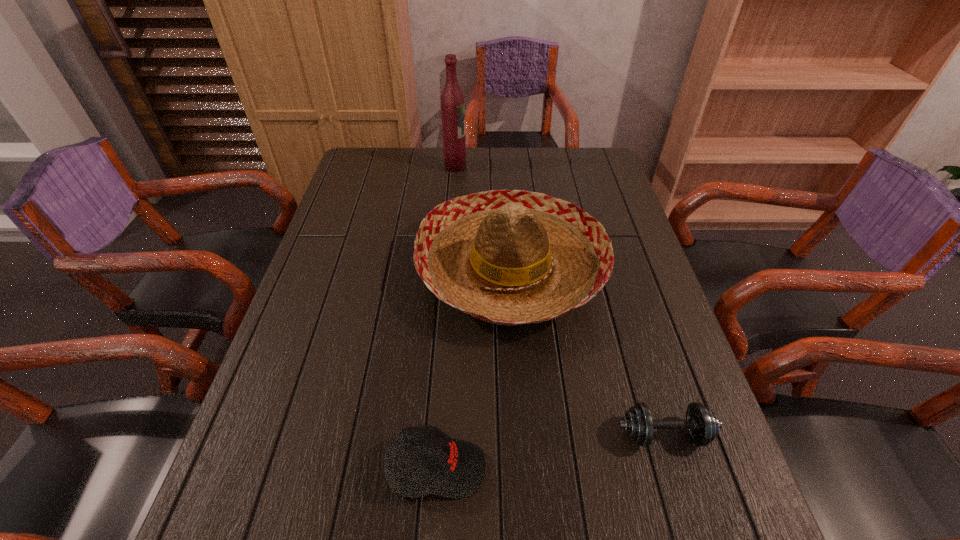
Identify the location of liquor. (452, 99).

Find the location of a particular element. The height and width of the screenshot is (540, 960). the tallest object is located at coordinates click(x=452, y=99).

Where is `the third nearest object`? the third nearest object is located at coordinates (510, 257).

You are a GUI agent. You are given a task and a screenshot of the screen. Output one action in this format:
    pyautogui.click(x=<x>, y=<y>)
    Task: Click on the sombrero
    The image size is (960, 540).
    Given the screenshot: What is the action you would take?
    pyautogui.click(x=510, y=257)

The height and width of the screenshot is (540, 960). Find the location of `the second shortest object`. the second shortest object is located at coordinates [x=458, y=471].

Where is `dumbbell`? The width and height of the screenshot is (960, 540). dumbbell is located at coordinates (702, 424).

At what (x,y) coordinates should I click in order to perform the action: click on vacant space located on the label of the tallest object. Please return your answer as a coordinate pair (x, y). This screenshot has height=540, width=960. Looking at the image, I should click on (553, 166).

The image size is (960, 540). In order to click on vacant area situated on the back of the sombrero in this screenshot , I will do `click(506, 187)`.

Find the location of a particular element. vacant space situated on the front-facing side of the third tallest object is located at coordinates (700, 468).

Identify the location of free region located on the back of the shortest object. Image resolution: width=960 pixels, height=540 pixels. (652, 393).